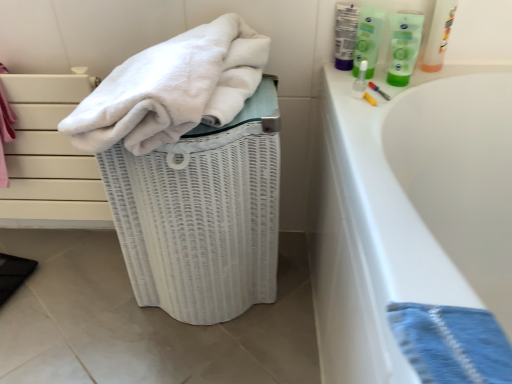
Question: Should I look upward or downward to see white soft towel at upper left?

Choices:
 (A) up
 (B) down

Answer: (A)

Question: From a real-world perspective, does green plastic tube at upper right sit lower than white soft towel at upper left?

Choices:
 (A) no
 (B) yes

Answer: (A)

Question: Is green plastic tube at upper right located outside white soft towel at upper left?

Choices:
 (A) no
 (B) yes

Answer: (B)

Question: Can you confirm if green plastic tube at upper right is positioned to the left of white soft towel at upper left?

Choices:
 (A) no
 (B) yes

Answer: (A)

Question: Is green plastic tube at upper right aimed at white soft towel at upper left?

Choices:
 (A) no
 (B) yes

Answer: (A)

Question: From a real-world perspective, is green plastic tube at upper right positioned over white soft towel at upper left based on gravity?

Choices:
 (A) no
 (B) yes

Answer: (B)

Question: From the image's perspective, is green plastic tube at upper right below white soft towel at upper left?

Choices:
 (A) yes
 (B) no

Answer: (B)

Question: Is blue woven towel at lower right thinner than green plastic bottle at upper right?

Choices:
 (A) no
 (B) yes

Answer: (A)

Question: Is blue woven towel at lower right bigger than green plastic bottle at upper right?

Choices:
 (A) yes
 (B) no

Answer: (A)

Question: Can you confirm if blue woven towel at lower right is smaller than green plastic bottle at upper right?

Choices:
 (A) no
 (B) yes

Answer: (A)

Question: Could green plastic bottle at upper right be considered to be inside blue woven towel at lower right?

Choices:
 (A) yes
 (B) no

Answer: (B)

Question: Does blue woven towel at lower right have a greater width compared to green plastic bottle at upper right?

Choices:
 (A) no
 (B) yes

Answer: (B)

Question: From a real-world perspective, is blue woven towel at lower right positioned over green plastic bottle at upper right based on gravity?

Choices:
 (A) yes
 (B) no

Answer: (B)

Question: Considering the relative sizes of blue woven towel at lower right and white soft towel at upper left in the image provided, is blue woven towel at lower right shorter than white soft towel at upper left?

Choices:
 (A) yes
 (B) no

Answer: (A)